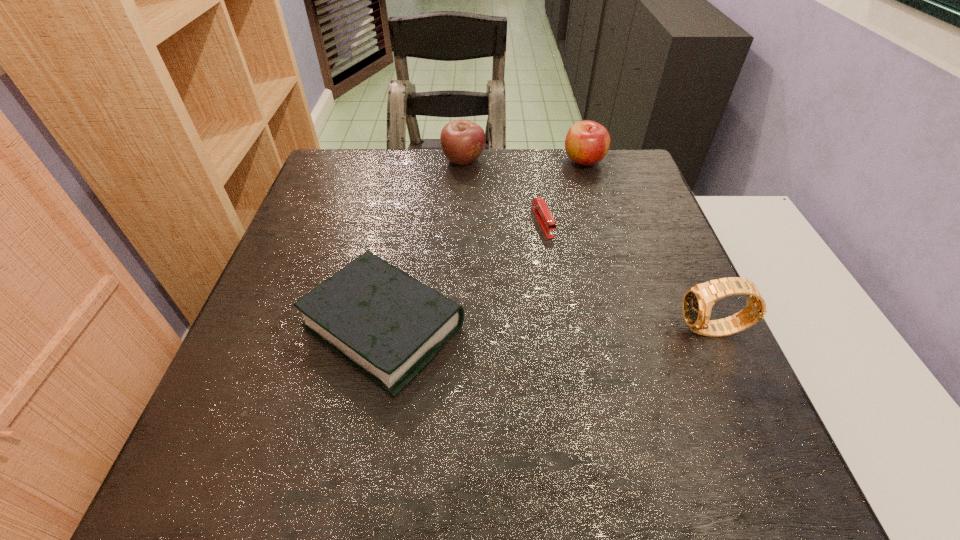
Where is `free spot between the stapler and the right apple`? The width and height of the screenshot is (960, 540). free spot between the stapler and the right apple is located at coordinates (564, 192).

Identify the location of free spot between the watch and the shortest object. (628, 276).

I want to click on empty location between the second shortest object and the right apple, so click(x=484, y=244).

I want to click on unoccupied area between the Bible and the left apple, so click(423, 244).

The image size is (960, 540). I want to click on unoccupied position between the shortest object and the second shortest object, so click(464, 274).

Locate an element on the screen. The height and width of the screenshot is (540, 960). free area in between the third object from left to right and the second shortest object is located at coordinates (464, 274).

Identify the location of empty space between the watch and the third nearest object. (628, 276).

Locate an element on the screen. The height and width of the screenshot is (540, 960). vacant area that lies between the second shortest object and the right apple is located at coordinates (484, 244).

The image size is (960, 540). I want to click on free area in between the Bible and the stapler, so click(x=464, y=274).

Locate an element on the screen. Image resolution: width=960 pixels, height=540 pixels. free space between the third object from right to left and the Bible is located at coordinates (464, 274).